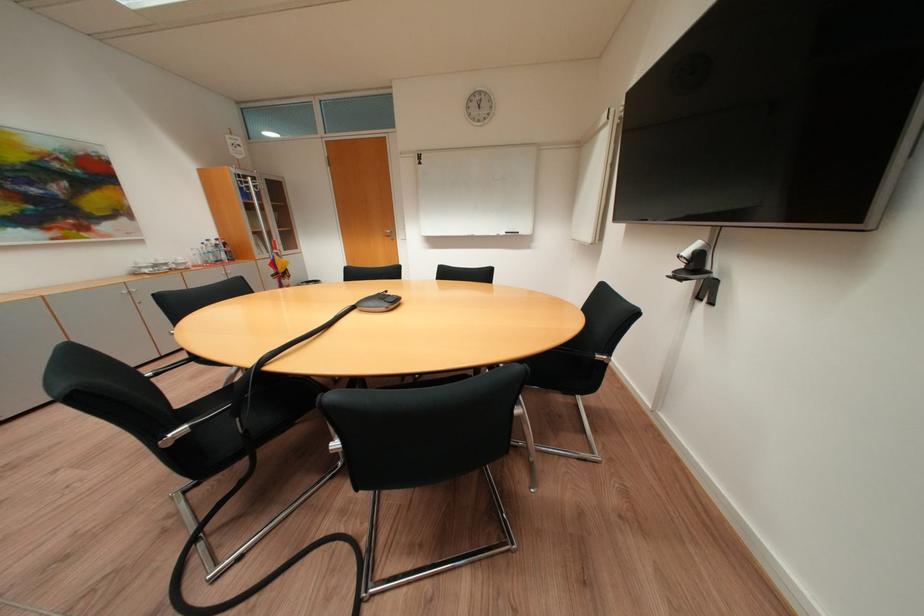
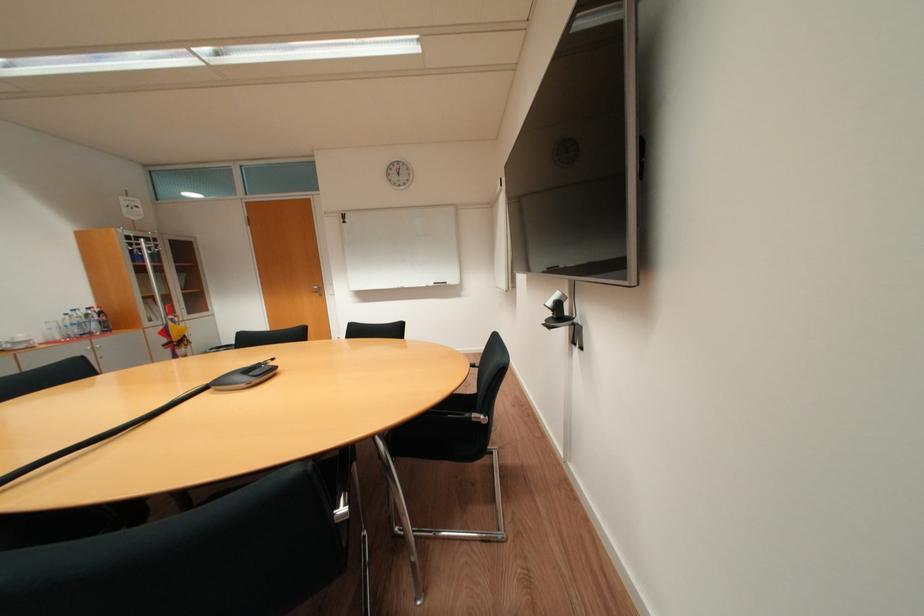
Locate, in the second image, the point that corresponds to point 605,357 in the first image.

(483, 416)